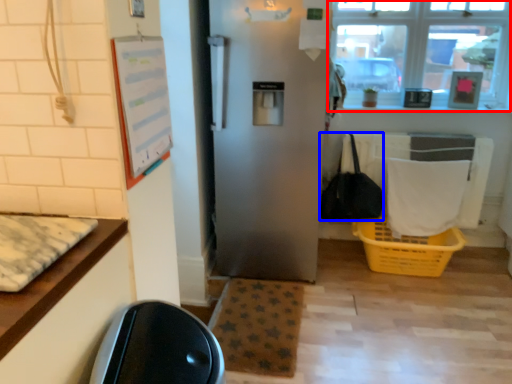
Question: Which point is further to the camera, window (highlighted by a red box) or handbag (highlighted by a blue box)?

Choices:
 (A) window
 (B) handbag

Answer: (A)